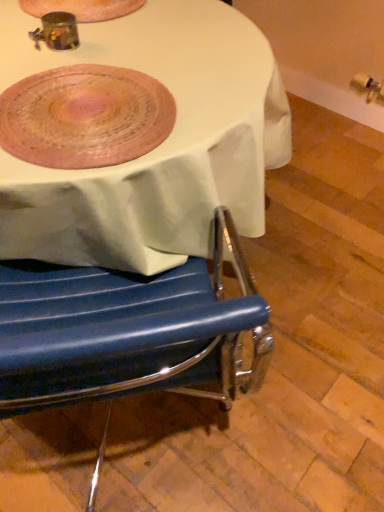
Question: Is blue leather chair at lower left taller or shorter than pink woven platter at upper left?

Choices:
 (A) short
 (B) tall

Answer: (B)

Question: From the image's perspective, is blue leather chair at lower left above or below pink woven platter at upper left?

Choices:
 (A) above
 (B) below

Answer: (B)

Question: Relative to pink woven platter at upper left, is blue leather chair at lower left in front or behind?

Choices:
 (A) behind
 (B) front

Answer: (A)

Question: In the image, is pink woven platter at upper left positioned in front of or behind blue leather chair at lower left?

Choices:
 (A) behind
 (B) front

Answer: (B)

Question: From a real-world perspective, is pink woven platter at upper left positioned above or below blue leather chair at lower left?

Choices:
 (A) above
 (B) below

Answer: (A)

Question: Is point (100, 109) closer or farther from the camera than point (132, 327)?

Choices:
 (A) closer
 (B) farther

Answer: (B)

Question: From the image's perspective, is pink woven platter at upper left located above or below blue leather chair at lower left?

Choices:
 (A) below
 (B) above

Answer: (B)